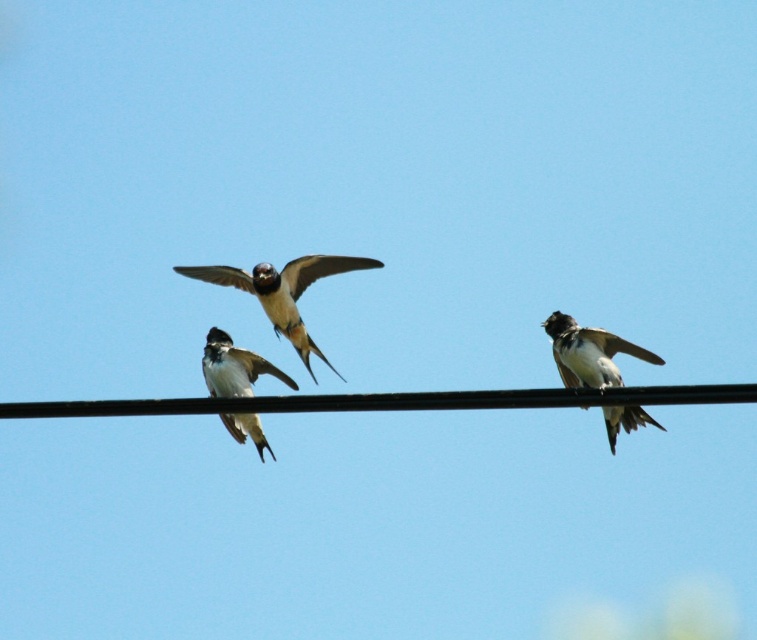
Based on the photo, you are a birdwatcher observing the scene. You notice the black wire at center and the black and white feathers at center. Which object is wider in this image?

The black wire at center might be wider than black and white feathers at center.